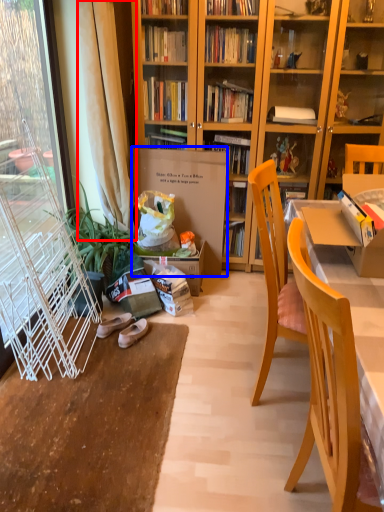
Question: Among these objects, which one is nearest to the camera, curtain (highlighted by a red box) or cardboard box (highlighted by a blue box)?

Choices:
 (A) curtain
 (B) cardboard box

Answer: (A)